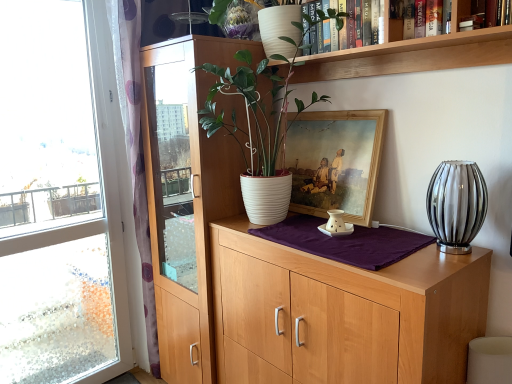
Measure the distance between point [463,187] and camera.

Point [463,187] and camera are 4.40 feet apart.

Where is `light wood cabinet at center`? The image size is (512, 384). light wood cabinet at center is located at coordinates (342, 313).

What do you see at coordinates (342, 313) in the screenshot? I see `light wood cabinet at center` at bounding box center [342, 313].

What is the approximate width of white matte shelf at upper center?

white matte shelf at upper center is 22.42 centimeters wide.

In order to face white ribbed pot at center, should I rotate leftwards or rightwards?

Turn right approximately 1.250 degrees to face it.

Describe the element at coordinates (335, 162) in the screenshot. I see `wooden framed painting at center` at that location.

What is the approximate width of hardcover book at upper right, placed as the 2th book when sorted from front to back?

hardcover book at upper right, placed as the 2th book when sorted from front to back, is 11.48 centimeters in width.

Where is `hardcover books at upper center, which is counted as the 3th book, starting from the front`? This screenshot has height=384, width=512. hardcover books at upper center, which is counted as the 3th book, starting from the front is located at coordinates (355, 26).

Considering the sizes of objects transparent glass window at left and hardcover book at upper right, acting as the 2th book starting from the left, in the image provided, who is taller, transparent glass window at left or hardcover book at upper right, acting as the 2th book starting from the left,?

transparent glass window at left.

Which is more to the left, transparent glass window at left or hardcover book at upper right, which is the 2th book in right-to-left order?

Positioned to the left is transparent glass window at left.

From the image's perspective, between transparent glass window at left and hardcover book at upper right, acting as the 2th book starting from the left, which one is located above?

hardcover book at upper right, acting as the 2th book starting from the left.

Does transparent glass window at left turn towards hardcover book at upper right, acting as the 2th book starting from the left?

No, transparent glass window at left is not aimed at hardcover book at upper right, acting as the 2th book starting from the left.

Is hardcover book at upper right, which is the third book in left-to-right order, located outside wooden framed painting at center?

Yes, hardcover book at upper right, which is the third book in left-to-right order, is not within wooden framed painting at center.

Where is `picture frame on the left of hardcover book at upper right, marked as the 3th book in a back-to-front arrangement`? This screenshot has height=384, width=512. picture frame on the left of hardcover book at upper right, marked as the 3th book in a back-to-front arrangement is located at coordinates (335, 162).

Does hardcover book at upper right, marked as the first book in a right-to-left arrangement, lie behind wooden framed painting at center?

No, it is not.

Between point (483, 17) and point (331, 48), which one is positioned behind?

The point (331, 48) is behind.

From the image's perspective, is hardcover book at upper right, which appears as the first book when viewed from the front, above or below hardcover books at upper center, which is counted as the 3th book, starting from the front?

Based on their image positions, hardcover book at upper right, which appears as the first book when viewed from the front, is located beneath hardcover books at upper center, which is counted as the 3th book, starting from the front.

Identify the location of book that is the 2nd object located in front of the hardcover books at upper center, which is the first book in back-to-front order. The width and height of the screenshot is (512, 384). (487, 14).

Considering the sizes of hardcover book at upper right, which appears as the first book when viewed from the front, and hardcover books at upper center, which is the first book in back-to-front order, in the image, is hardcover book at upper right, which appears as the first book when viewed from the front, taller or shorter than hardcover books at upper center, which is the first book in back-to-front order,?

Considering their sizes, hardcover book at upper right, which appears as the first book when viewed from the front, has less height than hardcover books at upper center, which is the first book in back-to-front order.

Consider the image. Which is more to the left, transparent glass window at left or hardcover book at upper right, marked as the 3th book in a back-to-front arrangement?

transparent glass window at left is more to the left.

From a real-world perspective, who is located lower, transparent glass window at left or hardcover book at upper right, which is the third book in left-to-right order?

In real-world perspective, transparent glass window at left is lower.

Between point (60, 238) and point (476, 23), which one is positioned behind?

The point (60, 238) is more distant.

From the image's perspective, between transparent glass window at left and hardcover book at upper right, marked as the 3th book in a back-to-front arrangement, which one is located above?

hardcover book at upper right, marked as the 3th book in a back-to-front arrangement, is shown above in the image.

Can you confirm if hardcover book at upper right, which is the 2th book in right-to-left order, is taller than hardcover books at upper center, which ranks as the first book in left-to-right order?

No, hardcover book at upper right, which is the 2th book in right-to-left order, is not taller than hardcover books at upper center, which ranks as the first book in left-to-right order.

How different are the orientations of hardcover book at upper right, the second book positioned from the back, and hardcover books at upper center, which is counted as the 3th book, starting from the front, in degrees?

The angle between the facing direction of hardcover book at upper right, the second book positioned from the back, and the facing direction of hardcover books at upper center, which is counted as the 3th book, starting from the front, is 0.616 degrees.

Looking at the image, does hardcover book at upper right, the second book positioned from the back, seem bigger or smaller compared to hardcover books at upper center, which ranks as the first book in left-to-right order?

In the image, hardcover book at upper right, the second book positioned from the back, appears to be smaller than hardcover books at upper center, which ranks as the first book in left-to-right order.

Is there a large distance between hardcover book at upper right, placed as the 2th book when sorted from front to back, and hardcover books at upper center, which ranks as the first book in left-to-right order?

They are positioned close to each other.

From a real-world perspective, is white ribbed pot at center on hardcover books at upper center, which is counted as the 3th book, starting from the front?

No.

Who is bigger, white ribbed pot at center or hardcover books at upper center, acting as the third book starting from the right?

white ribbed pot at center.

Between white ribbed pot at center and hardcover books at upper center, which is the first book in back-to-front order, which one has less height?

hardcover books at upper center, which is the first book in back-to-front order, is shorter.

From a real-world perspective, which is physically above, light wood cabinet at center or white matte shelf at upper center?

In real-world perspective, white matte shelf at upper center is above.

Does light wood cabinet at center have a lesser height compared to white matte shelf at upper center?

Incorrect, the height of light wood cabinet at center does not fall short of that of white matte shelf at upper center.

Would you say light wood cabinet at center is a long distance from white matte shelf at upper center?

That's not correct — light wood cabinet at center is a little close to white matte shelf at upper center.

Which is behind, light wood cabinet at center or white matte shelf at upper center?

light wood cabinet at center is behind.

From the image's perspective, starting from the transparent glass window at left, which book is the 2nd one above? Please provide its 2D coordinates.

[(392, 25)]

Where is `picture frame that appears below the hardcover book at upper right, which appears as the first book when viewed from the front (from a real-world perspective)`? Image resolution: width=512 pixels, height=384 pixels. picture frame that appears below the hardcover book at upper right, which appears as the first book when viewed from the front (from a real-world perspective) is located at coordinates (335, 162).

From the image, which object appears to be nearer to wooden framed painting at center, hardcover book at upper right, which is the 2th book in right-to-left order, or translucent glass vase at right?

translucent glass vase at right is closer to wooden framed painting at center.

Considering their positions, is white ribbed pot at center positioned further to hardcover books at upper center, which is the first book in back-to-front order, than hardcover book at upper right, acting as the 2th book starting from the left?

white ribbed pot at center is positioned further to the anchor hardcover books at upper center, which is the first book in back-to-front order.

Looking at the image, which one is located closer to light wood cabinet at center, transparent glass window at left or translucent glass vase at right?

The object closer to light wood cabinet at center is translucent glass vase at right.

Which object lies nearer to the anchor point transparent glass window at left, hardcover books at upper center, acting as the third book starting from the right, or translucent glass vase at right?

The object closer to transparent glass window at left is hardcover books at upper center, acting as the third book starting from the right.

Looking at the image, which one is located closer to white matte shelf at upper center, hardcover book at upper right, marked as the 3th book in a back-to-front arrangement, or wooden framed painting at center?

hardcover book at upper right, marked as the 3th book in a back-to-front arrangement, is closer to white matte shelf at upper center.

From the image, which object appears to be farther from wooden framed painting at center, transparent glass window at left or translucent glass vase at right?

transparent glass window at left.

From the image, which object appears to be nearer to translucent glass vase at right, hardcover books at upper center, which is the first book in back-to-front order, or light wood cabinet at center?

light wood cabinet at center is closer to translucent glass vase at right.

Considering their positions, is hardcover book at upper right, placed as the 2th book when sorted from front to back, positioned closer to light wood cabinet at center than hardcover books at upper center, which is counted as the 3th book, starting from the front?

hardcover books at upper center, which is counted as the 3th book, starting from the front, lies closer to light wood cabinet at center than the other object.

At what (x,y) coordinates should I click in order to perform the action: click on vase between white ribbed pot at center and light wood cabinet at center in the up-down direction. Please return your answer as a coordinate pair (x, y). Looking at the image, I should click on (456, 205).

You are a GUI agent. You are given a task and a screenshot of the screen. Output one action in this format:
    pyautogui.click(x=<x>, y=<y>)
    Task: Click on the houseplant between white matte shelf at upper center and light wood cabinet at center in the vertical direction
    
    Given the screenshot: What is the action you would take?
    pyautogui.click(x=258, y=126)

This screenshot has height=384, width=512. What are the coordinates of `picture frame between hardcover books at upper center, acting as the third book starting from the right, and translucent glass vase at right, in the vertical direction` in the screenshot? It's located at (335, 162).

At what (x,y) coordinates should I click in order to perform the action: click on vase between white ribbed pot at center and hardcover book at upper right, marked as the first book in a right-to-left arrangement, in the horizontal direction. Please return your answer as a coordinate pair (x, y). Looking at the image, I should click on (456, 205).